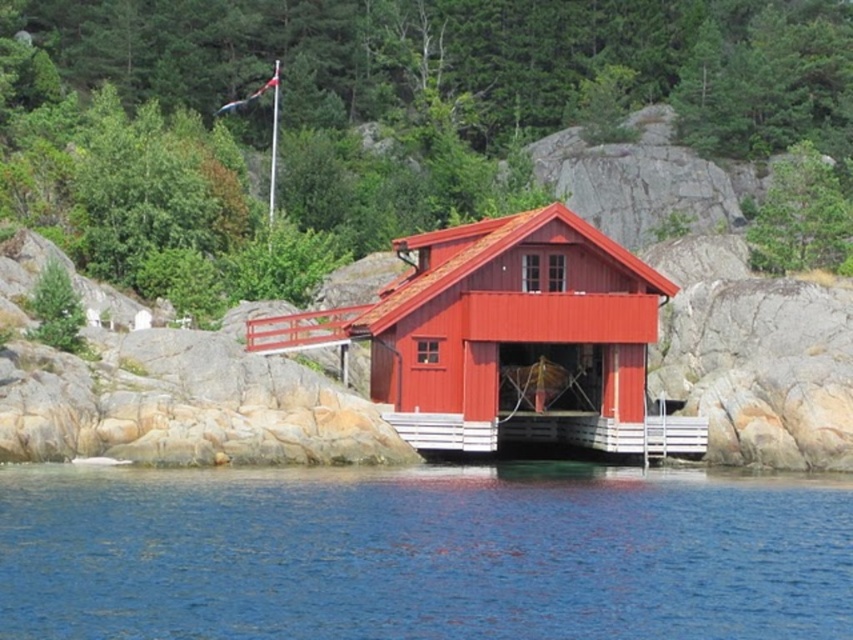
Which is above, blue water at lower center or white wooden dock at center?

white wooden dock at center is above.

Is point (56, 556) in front of point (671, 433)?

Yes, point (56, 556) is in front of point (671, 433).

Between point (593, 508) and point (543, 417), which one is positioned behind?

Positioned behind is point (543, 417).

Where is `blue water at lower center`? The width and height of the screenshot is (853, 640). blue water at lower center is located at coordinates (421, 556).

Can you confirm if matte red cabin at center is positioned to the right of white wooden dock at center?

Incorrect, matte red cabin at center is not on the right side of white wooden dock at center.

Can you confirm if matte red cabin at center is positioned above white wooden dock at center?

Indeed, matte red cabin at center is positioned over white wooden dock at center.

Does point (427, 440) lie in front of point (624, 426)?

That is True.

The width and height of the screenshot is (853, 640). I want to click on matte red cabin at center, so click(515, 337).

Find the location of `blue water at lower center`. blue water at lower center is located at coordinates (421, 556).

Does blue water at lower center have a lesser width compared to matte red cabin at center?

No, blue water at lower center is not thinner than matte red cabin at center.

Is point (206, 547) positioned before point (525, 212)?

That is True.

Image resolution: width=853 pixels, height=640 pixels. Find the location of `blue water at lower center`. blue water at lower center is located at coordinates (421, 556).